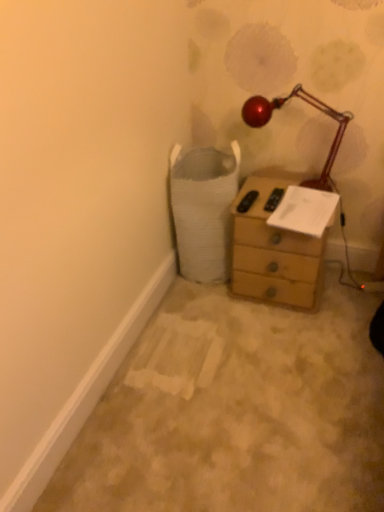
Locate an element on the screen. free space to the right of wooden chest of drawers at center is located at coordinates (346, 291).